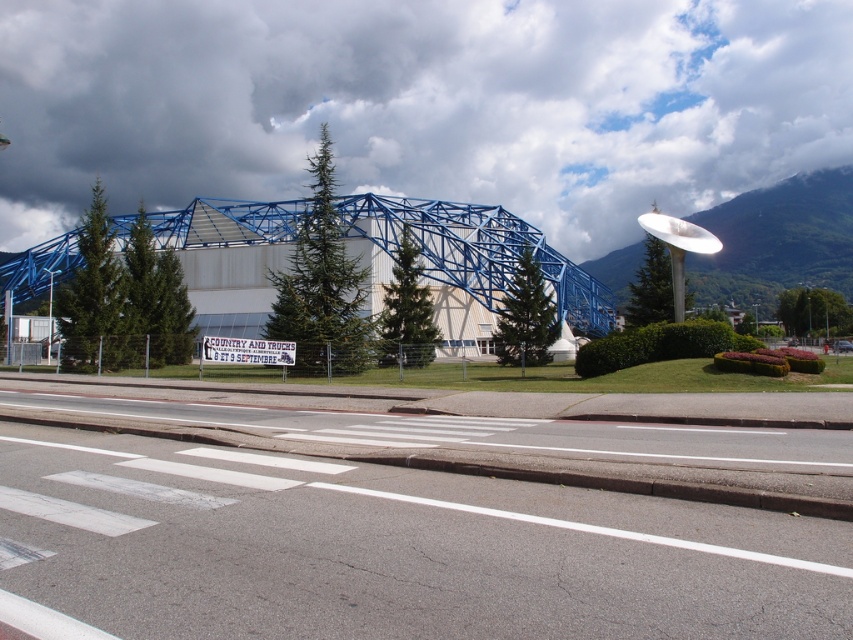
Looking at this image, you are a pedestrian standing at the pedestrian crossing area in front of the building. You see the white matte structure at upper center and the white glossy mountain at upper center. Which one is closer to you?

The white matte structure at upper center is closer to you because it is further to the viewer than the white glossy mountain at upper center.